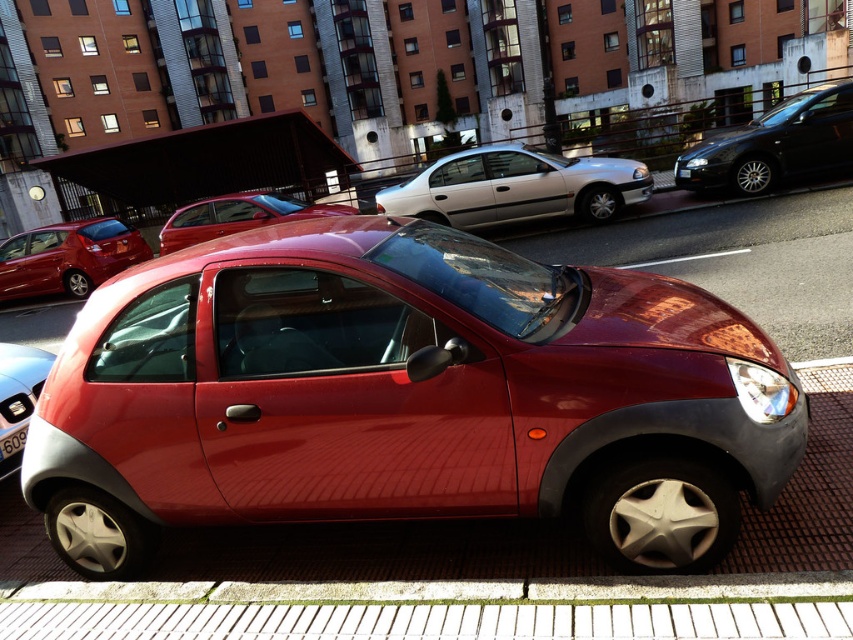
You are driving a car that is 4 meters long and need to park it between the glossy black sedan at upper right and the glossy red hatchback at left. Can you fit your car in the space between them?

The distance between the glossy black sedan at upper right and the glossy red hatchback at left is 12.06 meters. Since your car is only 4 meters long, there is enough space to park between them.

You are standing on the street and want to take a photo of both the white glossy sedan at center and the glossy black sedan at upper right. Which one should you point your camera towards first if you want to capture them in the order from closest to farthest?

The white glossy sedan at center is below the glossy black sedan at upper right, so you should point your camera towards the white glossy sedan at center first since it is closer to you.